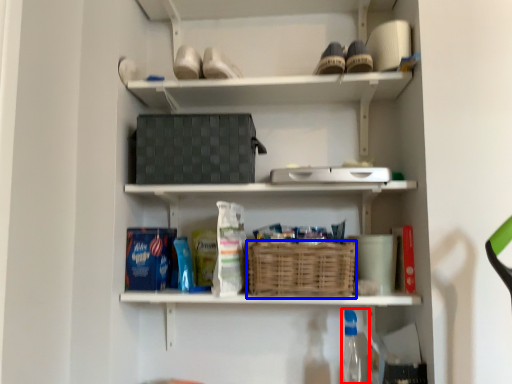
Question: Among these objects, which one is nearest to the camera, bottle (highlighted by a red box) or basket (highlighted by a blue box)?

Choices:
 (A) bottle
 (B) basket

Answer: (B)